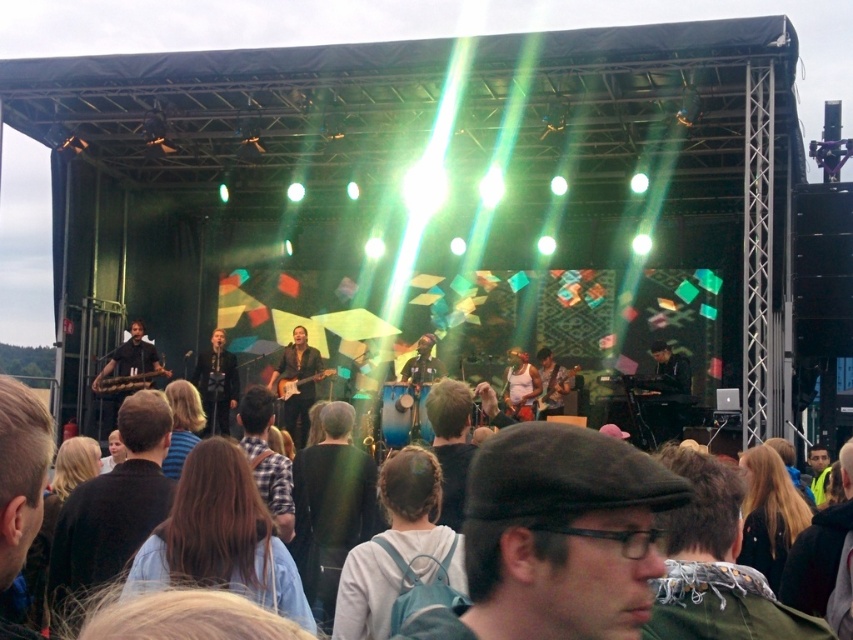
Can you confirm if white matte tank top at center is wider than wooden guitar at center?

Yes, white matte tank top at center is wider than wooden guitar at center.

Between point (527, 396) and point (543, 385), which one is positioned in front?

Point (527, 396)

At what (x,y) coordinates should I click in order to perform the action: click on white matte tank top at center. Please return your answer as a coordinate pair (x, y). This screenshot has width=853, height=640. Looking at the image, I should click on (521, 385).

Is shiny brown guitar at center thinner than wooden guitar at center?

In fact, shiny brown guitar at center might be wider than wooden guitar at center.

Is point (306, 435) farther from camera compared to point (544, 388)?

Yes.

Does point (296, 330) come in front of point (550, 388)?

No, (296, 330) is behind (550, 388).

Find the location of a particular element. This screenshot has width=853, height=640. shiny brown guitar at center is located at coordinates (299, 381).

Looking at this image, who is more forward, (200,369) or (543,365)?

Point (543,365) is in front.

From the picture: Who is positioned more to the right, matte black shirt at center or wooden guitar at center?

From the viewer's perspective, wooden guitar at center appears more on the right side.

Is point (221, 396) farther from camera compared to point (561, 387)?

Yes, point (221, 396) is farther from viewer.

You are a GUI agent. You are given a task and a screenshot of the screen. Output one action in this format:
    pyautogui.click(x=<x>, y=<y>)
    Task: Click on the matte black shirt at center
    The image size is (853, 640).
    Given the screenshot: What is the action you would take?
    pyautogui.click(x=216, y=384)